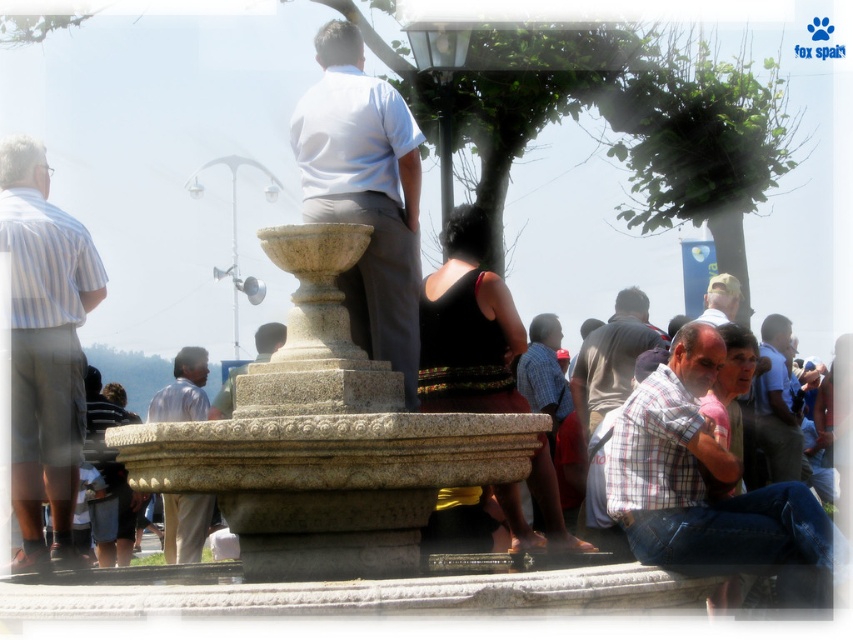
You are standing at the origin point of the coordinate system. You want to walk towards the granite fountain at center. What direction should you head?

The granite fountain at center is located at coordinate point 0.684 in the x direction and 0.382 in the y direction. Since you are at the origin, you should head in the direction of positive x and positive y to reach the granite fountain at center.